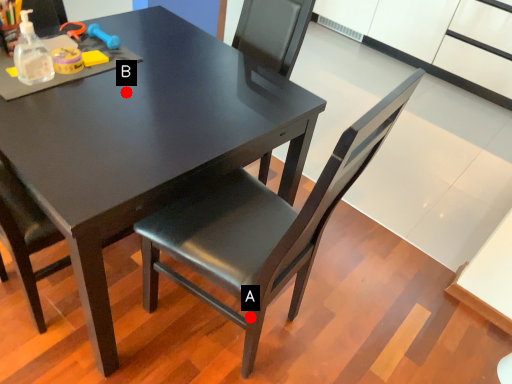
Question: Two points are circled on the image, labeled by A and B beside each circle. Which point is farther to the camera?

Choices:
 (A) A is further
 (B) B is further

Answer: (B)